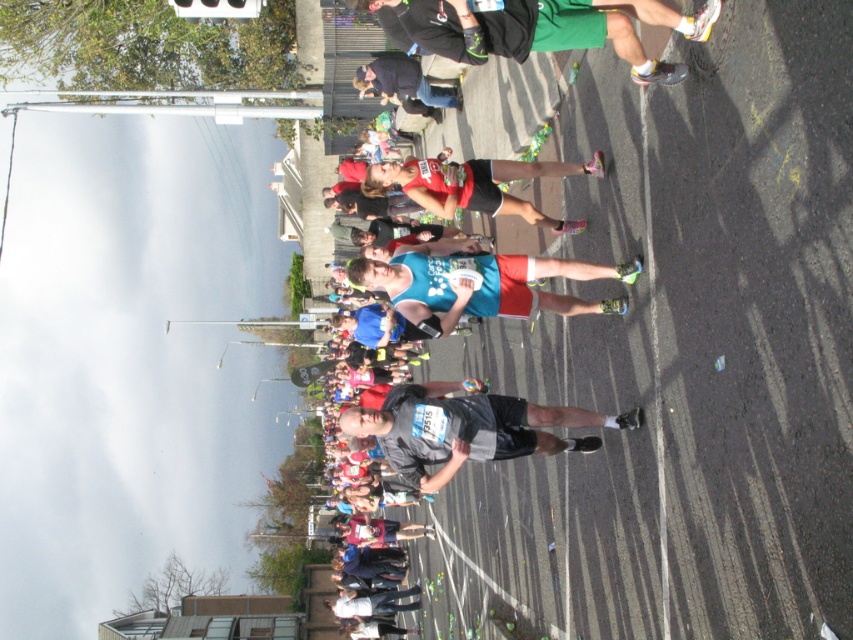
You are a photographer positioned at the starting line of the marathon. You want to capture a photo of both the dark gray fabric shirt at center and the blue fabric shorts at center in the same frame. Based on their positions, which object should you focus on first to ensure both are in the shot?

The dark gray fabric shirt at center is located below blue fabric shorts at center, so you should focus on the blue fabric shorts at center first to ensure both are in the frame.

You are a runner in the marathon and you need to reach the finish line. You see two points on your route marked as point 1 at coordinate point [529,452] and point 2 at coordinate point [354,278]. Which point should you head towards first to stay on the correct path?

You should head towards point 1 at coordinate point [529,452] first because it is in front of point 2 at coordinate point [354,278] along the route.